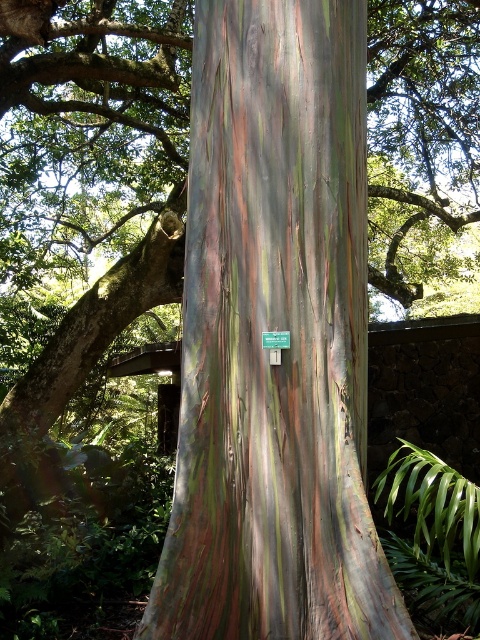
You are a botanist examining a tree trunk with rainbow bark in a tropical setting. You notice a specific point marked at coordinates (275, 330). Based on the description provided, what does this point most likely represent?

The point at coordinates (275, 330) most likely represents the location of the rainbow bark tree trunk at center, as indicated by the Objects Description.

You are a botanist examining the rainbow bark tree trunk at center and the green plastic sign at center. Which object is positioned closer to your viewpoint?

The rainbow bark tree trunk at center is closer to the viewer than the green plastic sign at center.

You are a botanist examining the rainbow bark tree trunk at center and the green plastic sign at center. Which object is closer to you, the observer?

The rainbow bark tree trunk at center is closer to the observer because it is positioned over the green plastic sign at center, indicating it is in front.